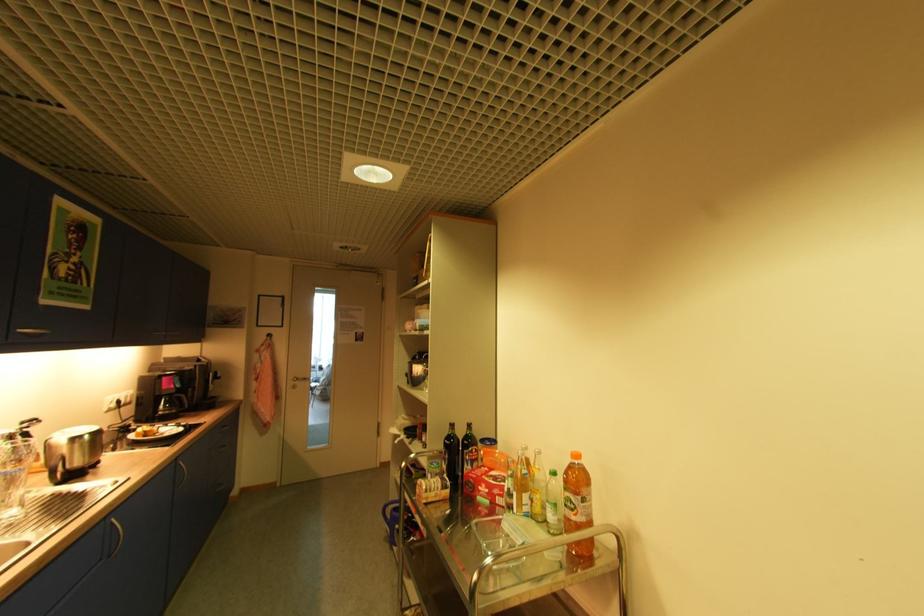
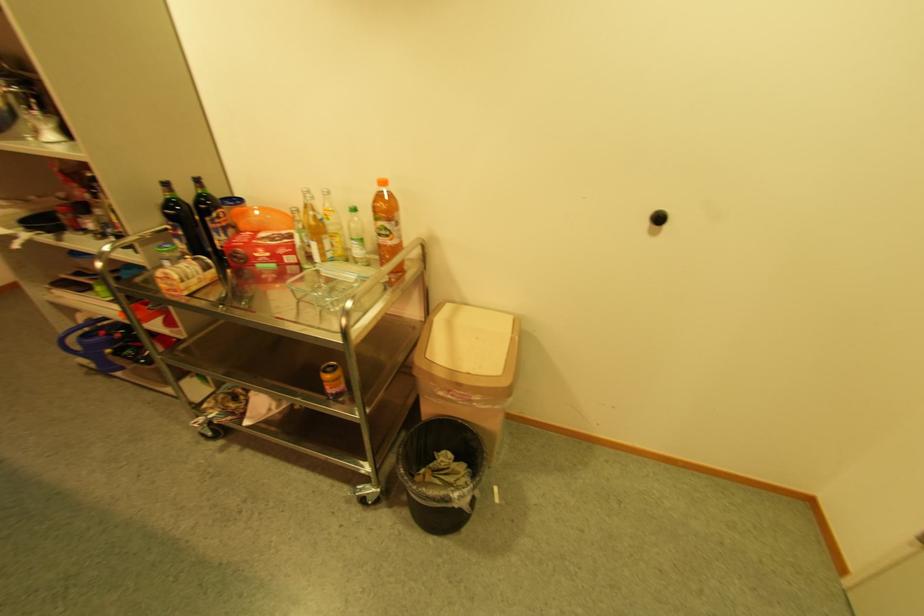
Where in the second image is the point corresponding to pixel 492 503 from the first image?

(278, 267)